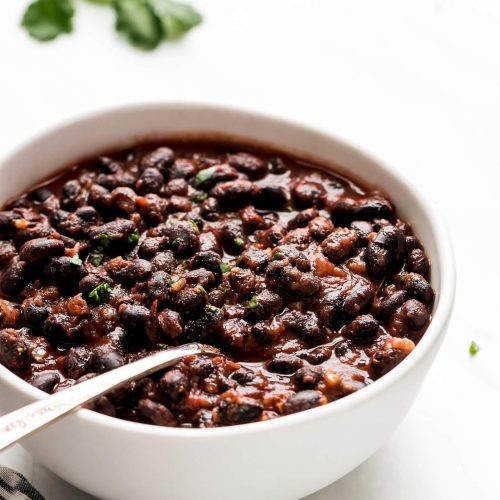
Find the location of a particular element. silver spoon is located at coordinates (152, 370).